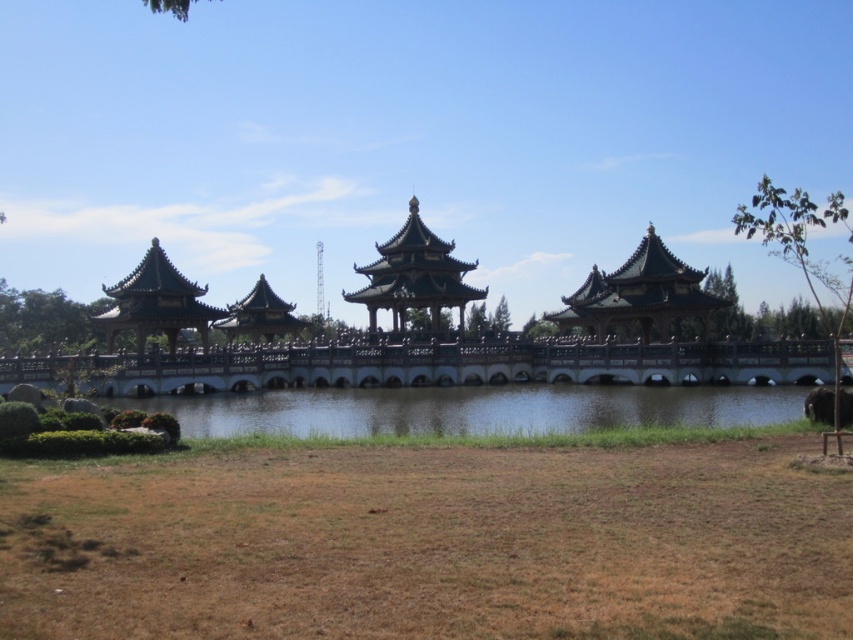
Which is above, dark brown wooden bridge at center or clear water at center?

dark brown wooden bridge at center

Can you confirm if dark brown wooden bridge at center is positioned below clear water at center?

No, dark brown wooden bridge at center is not below clear water at center.

Which is in front, point (9, 376) or point (231, 413)?

Point (9, 376) is more forward.

Where is `dark brown wooden bridge at center`? dark brown wooden bridge at center is located at coordinates (428, 365).

Between clear water at center and wooden pagoda at center, which one has more height?

wooden pagoda at center

Where is `clear water at center`? clear water at center is located at coordinates (473, 410).

Is point (590, 426) positioned behind point (430, 284)?

That is False.

This screenshot has width=853, height=640. I want to click on clear water at center, so click(473, 410).

In the scene shown: Can you confirm if dark brown wooden bridge at center is positioned below wooden pagoda at center?

Yes, dark brown wooden bridge at center is below wooden pagoda at center.

Is the position of dark brown wooden bridge at center less distant than that of wooden pagoda at center?

Yes, dark brown wooden bridge at center is closer to the viewer.

I want to click on dark brown wooden bridge at center, so click(428, 365).